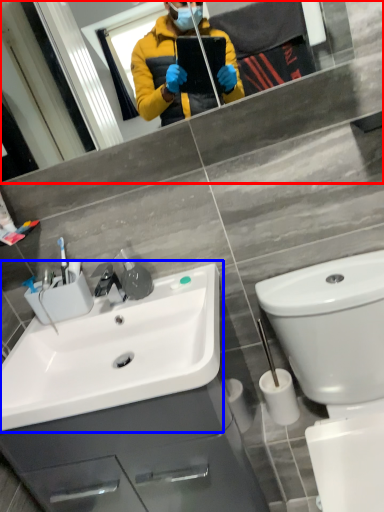
Question: Which point is further to the camera, mirror (highlighted by a red box) or sink (highlighted by a blue box)?

Choices:
 (A) mirror
 (B) sink

Answer: (B)